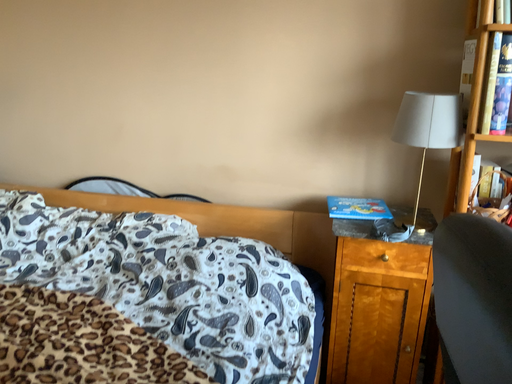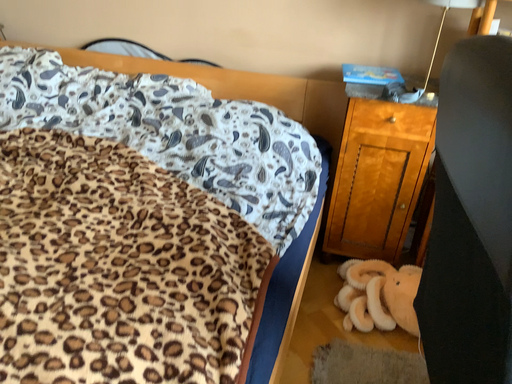
Question: Which way did the camera rotate in the video?

Choices:
 (A) rotated downward
 (B) rotated upward

Answer: (A)